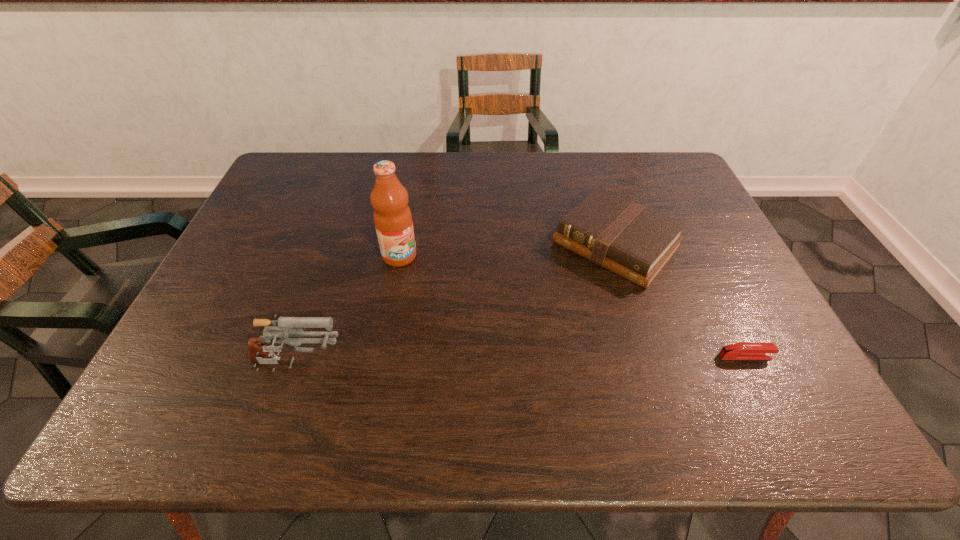
Identify the location of free spot on the desktop that is between the second tallest object and the stapler and is positioned on the front label of the fruit juice. (531, 361).

Locate an element on the screen. free spot on the desktop that is between the third shortest object and the shortest object and is positioned on the spine side of the Bible is located at coordinates (505, 362).